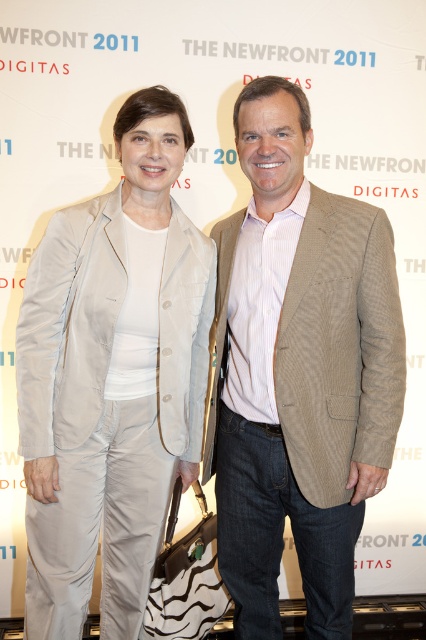
Who is higher up, light beige satin suit at center or beige corduroy blazer at center?

Positioned higher is beige corduroy blazer at center.

Which is behind, point (118, 452) or point (339, 266)?

Positioned behind is point (118, 452).

You are a GUI agent. You are given a task and a screenshot of the screen. Output one action in this format:
    pyautogui.click(x=<x>, y=<y>)
    Task: Click on the light beige satin suit at center
    
    Given the screenshot: What is the action you would take?
    pyautogui.click(x=109, y=404)

Locate an element on the screen. Image resolution: width=426 pixels, height=640 pixels. light beige satin suit at center is located at coordinates (109, 404).